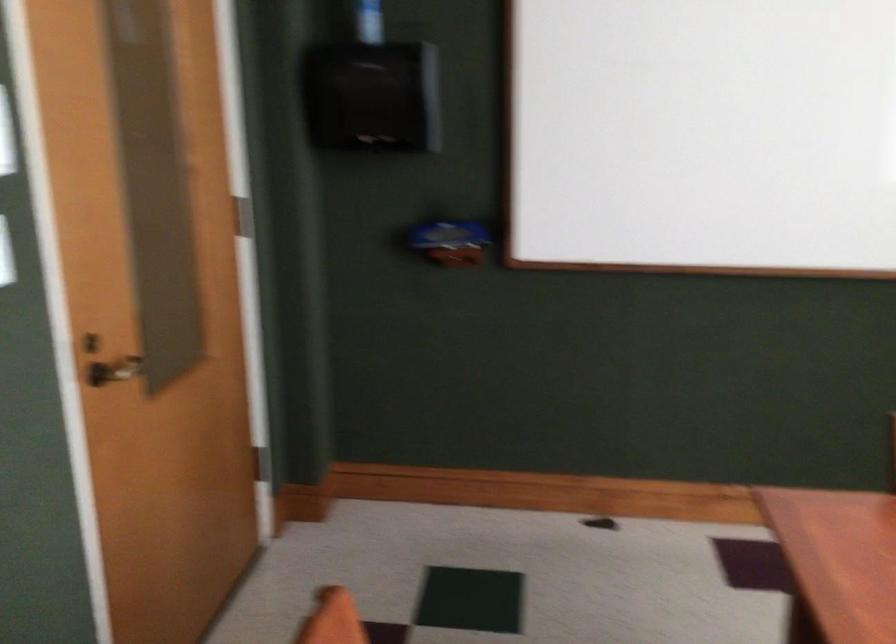
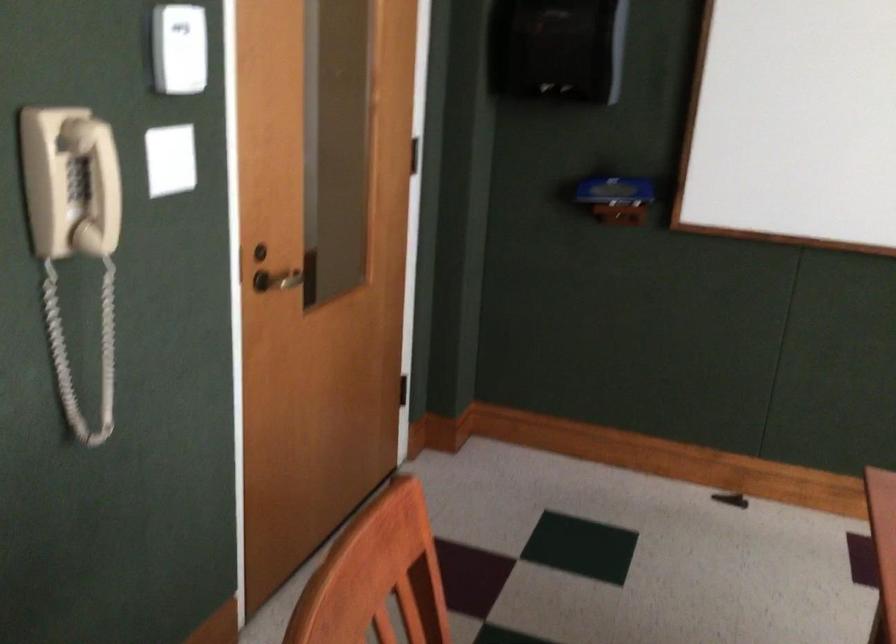
Question: The images are taken continuously from a first-person perspective. In which direction is your viewpoint rotating?

Choices:
 (A) Left
 (B) Right
 (C) Up
 (D) Down

Answer: (A)